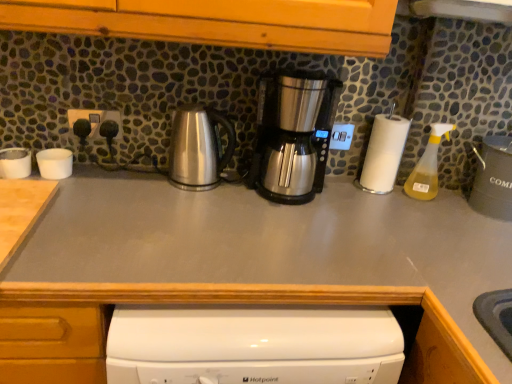
Question: Can you confirm if stainless steel coffee maker at center, acting as the first kitchen appliance starting from the right, is positioned to the left of white matte cups at left, which is counted as the 2th appliance, starting from the left?

Choices:
 (A) yes
 (B) no

Answer: (B)

Question: Is stainless steel coffee maker at center, acting as the first kitchen appliance starting from the right, not near white matte cups at left, arranged as the 2th appliance when viewed from the right?

Choices:
 (A) no
 (B) yes

Answer: (A)

Question: Considering the relative sizes of stainless steel coffee maker at center, marked as the 2th kitchen appliance in a left-to-right arrangement, and white matte cups at left, arranged as the 2th appliance when viewed from the right, in the image provided, is stainless steel coffee maker at center, marked as the 2th kitchen appliance in a left-to-right arrangement, bigger than white matte cups at left, arranged as the 2th appliance when viewed from the right,?

Choices:
 (A) no
 (B) yes

Answer: (B)

Question: From the image's perspective, does stainless steel coffee maker at center, acting as the first kitchen appliance starting from the right, appear lower than white matte cups at left, arranged as the 2th appliance when viewed from the right?

Choices:
 (A) no
 (B) yes

Answer: (A)

Question: From the image's perspective, would you say stainless steel coffee maker at center, marked as the 2th kitchen appliance in a left-to-right arrangement, is positioned over white matte cups at left, arranged as the 2th appliance when viewed from the right?

Choices:
 (A) yes
 (B) no

Answer: (A)

Question: In the image, is matte gray canister at right, which appears as the first appliance when viewed from the right, positioned in front of or behind white plastic cups at left, arranged as the first appliance when viewed from the left?

Choices:
 (A) front
 (B) behind

Answer: (A)

Question: Visually, is matte gray canister at right, which appears as the first appliance when viewed from the right, positioned to the left or to the right of white plastic cups at left, placed as the 3th appliance when sorted from right to left?

Choices:
 (A) right
 (B) left

Answer: (A)

Question: From a real-world perspective, is matte gray canister at right, which appears as the first appliance when viewed from the right, above or below white plastic cups at left, placed as the 3th appliance when sorted from right to left?

Choices:
 (A) below
 (B) above

Answer: (B)

Question: In terms of width, does matte gray canister at right, the third appliance positioned from the left, look wider or thinner when compared to white plastic cups at left, arranged as the first appliance when viewed from the left?

Choices:
 (A) thin
 (B) wide

Answer: (B)

Question: From a real-world perspective, is satin silver outlet at upper center above or below white matte cups at left, arranged as the 2th appliance when viewed from the right?

Choices:
 (A) below
 (B) above

Answer: (B)

Question: Is satin silver outlet at upper center wider or thinner than white matte cups at left, which is counted as the 2th appliance, starting from the left?

Choices:
 (A) wide
 (B) thin

Answer: (B)

Question: Is satin silver outlet at upper center to the left or to the right of white matte cups at left, arranged as the 2th appliance when viewed from the right, in the image?

Choices:
 (A) left
 (B) right

Answer: (B)

Question: In the image, is satin silver outlet at upper center positioned in front of or behind white matte cups at left, which is counted as the 2th appliance, starting from the left?

Choices:
 (A) front
 (B) behind

Answer: (B)

Question: From a real-world perspective, is gray matte countertop at center above or below white matte cups at left, which is counted as the 2th appliance, starting from the left?

Choices:
 (A) above
 (B) below

Answer: (B)

Question: Considering the relative positions of gray matte countertop at center and white matte cups at left, arranged as the 2th appliance when viewed from the right, in the image provided, is gray matte countertop at center to the left or to the right of white matte cups at left, arranged as the 2th appliance when viewed from the right,?

Choices:
 (A) left
 (B) right

Answer: (B)